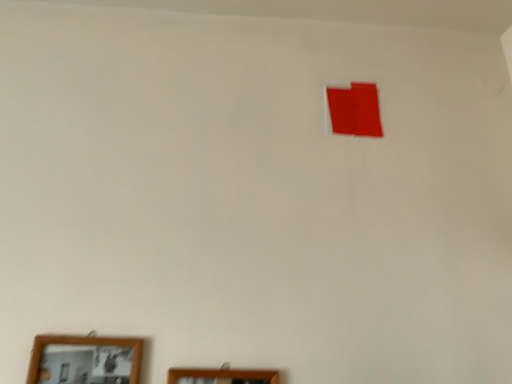
Question: Is wooden picture frame at lower center, positioned as the second picture frame in left-to-right order, positioned beyond the bounds of wooden framed mirror at lower left, acting as the 2th picture frame starting from the right?

Choices:
 (A) yes
 (B) no

Answer: (A)

Question: Considering the relative sizes of wooden picture frame at lower center, which is the 1th picture frame from right to left, and wooden framed mirror at lower left, acting as the 2th picture frame starting from the right, in the image provided, is wooden picture frame at lower center, which is the 1th picture frame from right to left, smaller than wooden framed mirror at lower left, acting as the 2th picture frame starting from the right,?

Choices:
 (A) no
 (B) yes

Answer: (B)

Question: From the image's perspective, is wooden picture frame at lower center, positioned as the second picture frame in left-to-right order, beneath wooden framed mirror at lower left, which is the first picture frame from left to right?

Choices:
 (A) yes
 (B) no

Answer: (A)

Question: Considering the relative sizes of wooden picture frame at lower center, which is the 1th picture frame from right to left, and wooden framed mirror at lower left, which is the first picture frame from left to right, in the image provided, is wooden picture frame at lower center, which is the 1th picture frame from right to left, shorter than wooden framed mirror at lower left, which is the first picture frame from left to right,?

Choices:
 (A) no
 (B) yes

Answer: (B)

Question: Is wooden framed mirror at lower left, which is the first picture frame from left to right, completely or partially inside wooden picture frame at lower center, positioned as the second picture frame in left-to-right order?

Choices:
 (A) no
 (B) yes

Answer: (A)

Question: Does wooden picture frame at lower center, positioned as the second picture frame in left-to-right order, turn towards wooden framed mirror at lower left, which is the first picture frame from left to right?

Choices:
 (A) yes
 (B) no

Answer: (B)

Question: Is wooden picture frame at lower center, positioned as the second picture frame in left-to-right order, at the back of wooden framed mirror at lower left, which is the first picture frame from left to right?

Choices:
 (A) no
 (B) yes

Answer: (A)

Question: Are wooden framed mirror at lower left, acting as the 2th picture frame starting from the right, and wooden picture frame at lower center, positioned as the second picture frame in left-to-right order, making contact?

Choices:
 (A) yes
 (B) no

Answer: (B)

Question: Can you confirm if wooden framed mirror at lower left, which is the first picture frame from left to right, is bigger than wooden picture frame at lower center, which is the 1th picture frame from right to left?

Choices:
 (A) no
 (B) yes

Answer: (B)

Question: Is wooden framed mirror at lower left, which is the first picture frame from left to right, to the left of wooden picture frame at lower center, positioned as the second picture frame in left-to-right order, from the viewer's perspective?

Choices:
 (A) no
 (B) yes

Answer: (B)

Question: Is the position of wooden framed mirror at lower left, which is the first picture frame from left to right, less distant than that of wooden picture frame at lower center, which is the 1th picture frame from right to left?

Choices:
 (A) yes
 (B) no

Answer: (A)

Question: Can you confirm if wooden framed mirror at lower left, acting as the 2th picture frame starting from the right, is shorter than wooden picture frame at lower center, positioned as the second picture frame in left-to-right order?

Choices:
 (A) no
 (B) yes

Answer: (A)

Question: Relative to wooden picture frame at lower center, positioned as the second picture frame in left-to-right order, is wooden framed mirror at lower left, acting as the 2th picture frame starting from the right, in front or behind?

Choices:
 (A) front
 (B) behind

Answer: (A)